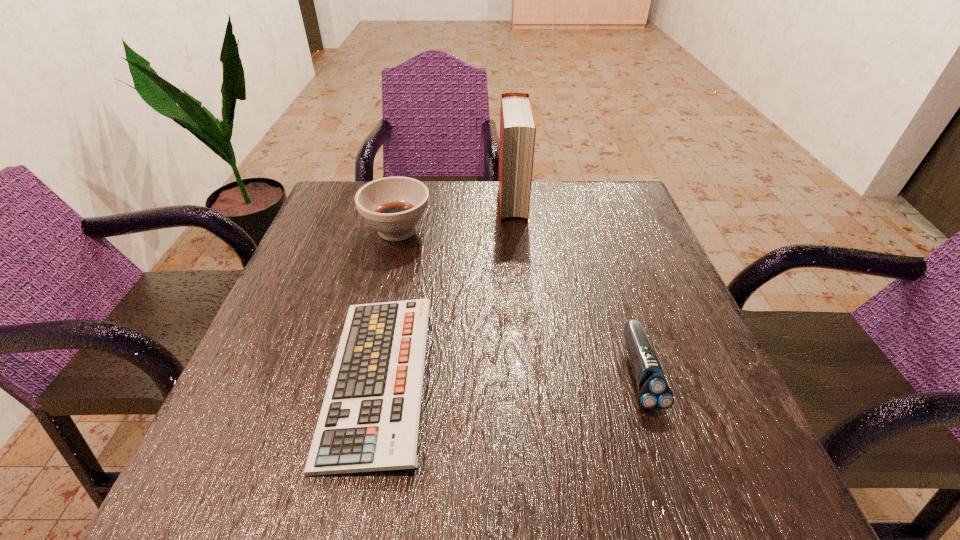
The width and height of the screenshot is (960, 540). Identify the location of hardback book present at the far edge. (517, 121).

Identify the location of soup bowl at the far edge. This screenshot has height=540, width=960. (394, 206).

Image resolution: width=960 pixels, height=540 pixels. In order to click on object located in the near edge section of the desktop in this screenshot , I will do `click(369, 421)`.

At what (x,y) coordinates should I click in order to perform the action: click on soup bowl at the left edge. Please return your answer as a coordinate pair (x, y). The width and height of the screenshot is (960, 540). Looking at the image, I should click on click(394, 206).

Identify the location of computer keyboard situated at the left edge. The width and height of the screenshot is (960, 540). (369, 421).

Where is `object located at the right edge`? The image size is (960, 540). object located at the right edge is located at coordinates (654, 394).

Identify the location of object that is at the far left corner. (394, 206).

Locate an element on the screen. The image size is (960, 540). object situated at the near left corner is located at coordinates (369, 421).

The width and height of the screenshot is (960, 540). I want to click on vacant region at the far edge of the desktop, so click(499, 205).

In the image, there is a desktop. In order to click on vacant space at the near edge in this screenshot , I will do click(404, 490).